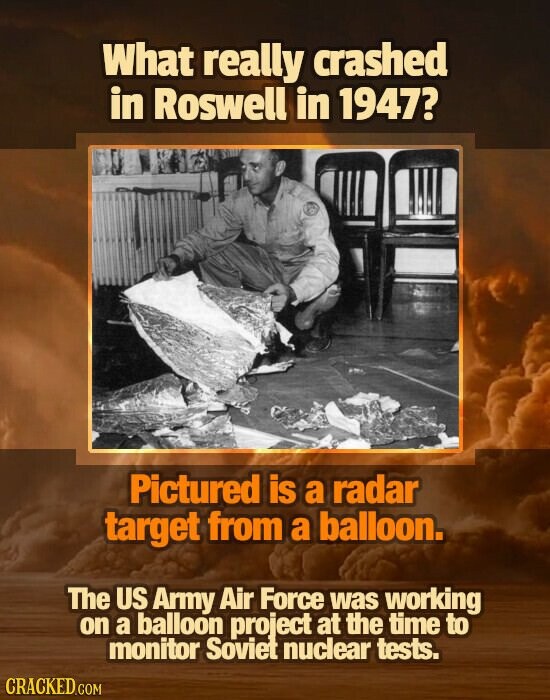
Locate an element on the screen. The width and height of the screenshot is (550, 700). back rest of chairs is located at coordinates (346, 160), (428, 168).